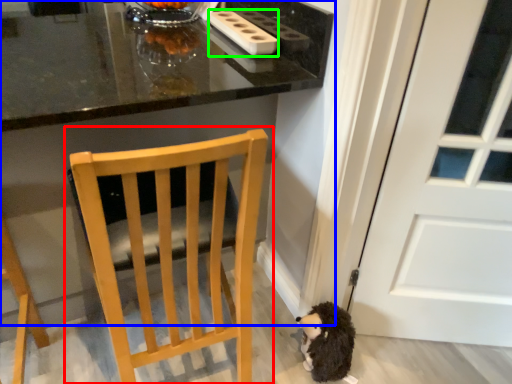
Question: Based on their relative distances, which object is nearer to chair (highlighted by a red box)? Choose from table (highlighted by a blue box) and appliance (highlighted by a green box).

Choices:
 (A) table
 (B) appliance

Answer: (A)